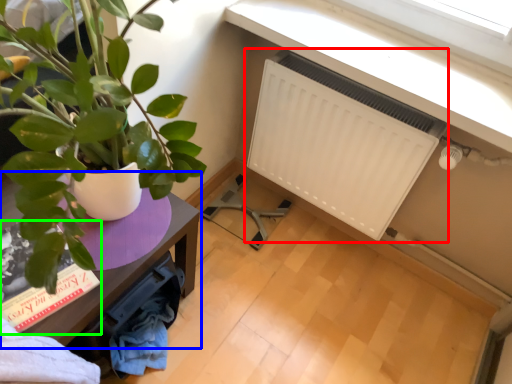
Question: Which object is the closest to the radiator (highlighted by a red box)? Choose among these: table (highlighted by a blue box) or book (highlighted by a green box).

Choices:
 (A) table
 (B) book

Answer: (A)